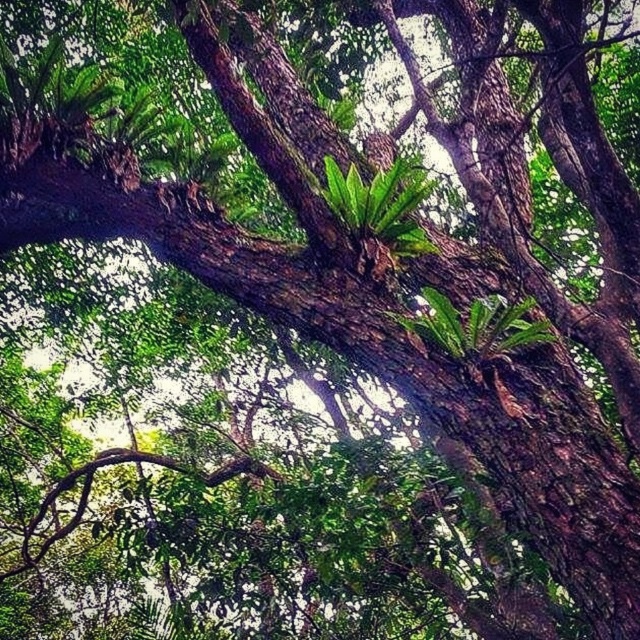
You are a botanist examining two ferns in the forest scene. The first is the green leafy fern at upper center, and the second is the green leafy fern at center. Which of these ferns is bigger?

The green leafy fern at upper center is larger in size compared to the green leafy fern at center.

You are standing in the forest looking up at the canopy. There is a green leafy fern at upper center. If you want to reach it, which direction should you move relative to your current position?

The green leafy fern at upper center is located at point (380, 205), so you should move towards the upper center direction to reach it.

You are a bird flying through the forest and want to land on one of the ferns. Which fern, the green leafy fern at upper center or the green leafy fern at center, is closer to you as you approach from above?

The green leafy fern at upper center is closer to you because the green leafy fern at center is behind it.